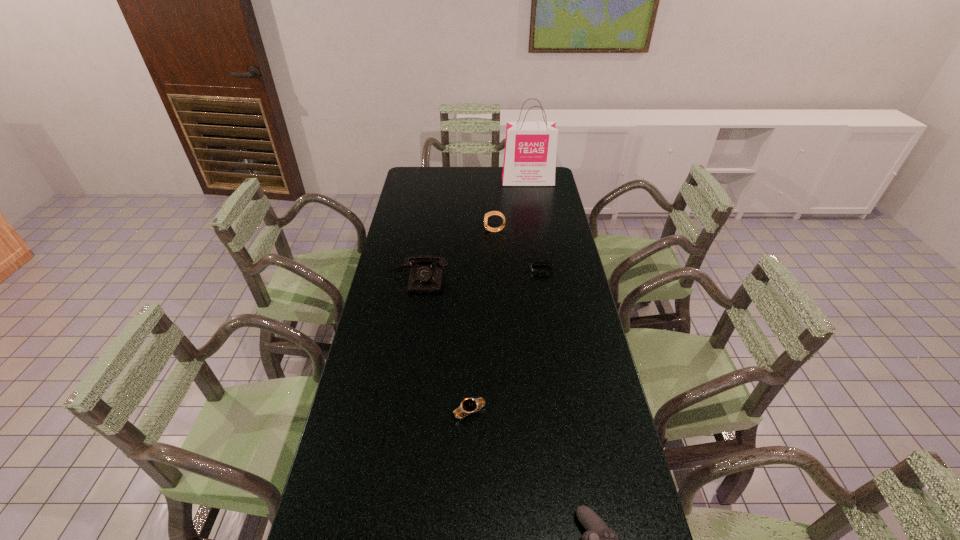
Locate an element on the screen. free space located 0.140m on the face of the taller watch is located at coordinates (451, 231).

Identify the location of vacant region located on the face of the taller watch. (465, 231).

You are a GUI agent. You are given a task and a screenshot of the screen. Output one action in this format:
    pyautogui.click(x=<x>, y=<y>)
    Task: Click on the vacant area located 0.120m on the face of the taller watch
    The width and height of the screenshot is (960, 540).
    Given the screenshot: What is the action you would take?
    point(456,231)

Locate an element on the screen. free space located 0.240m on the left of the shorter watch is located at coordinates (366, 412).

Where is `blank area located on the display of the shortest object`? blank area located on the display of the shortest object is located at coordinates (475, 269).

You are a GUI agent. You are given a task and a screenshot of the screen. Output one action in this format:
    pyautogui.click(x=<x>, y=<y>)
    Task: Click on the free space located 0.060m on the display of the shortest object
    
    Given the screenshot: What is the action you would take?
    pyautogui.click(x=515, y=269)

The width and height of the screenshot is (960, 540). What are the coordinates of `vacant area located 0.280m on the display of the shortest object` in the screenshot? It's located at (456, 269).

The height and width of the screenshot is (540, 960). Find the location of `object that is at the far edge`. object that is at the far edge is located at coordinates (530, 147).

The height and width of the screenshot is (540, 960). In order to click on object located at the left edge in this screenshot , I will do `click(425, 278)`.

Identify the location of shopping bag situated at the right edge. The width and height of the screenshot is (960, 540). (530, 147).